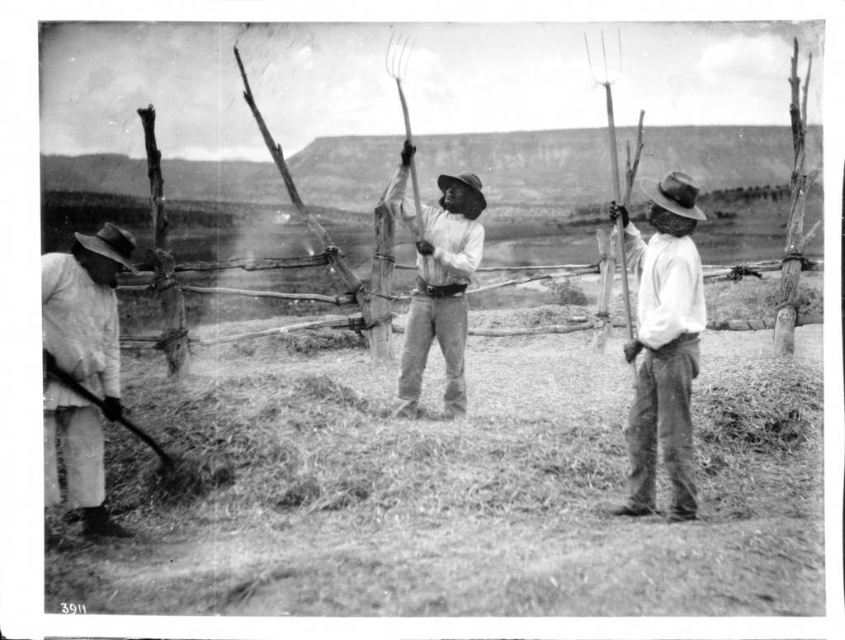
Image resolution: width=845 pixels, height=640 pixels. What do you see at coordinates (663, 344) in the screenshot?
I see `smooth white shirt at right` at bounding box center [663, 344].

Is smooth white shirt at right behind smooth wood pitchfork at center?

That is False.

Who is more forward, (698, 337) or (451, 333)?

Point (451, 333)

The image size is (845, 640). What are the coordinates of `smooth white shirt at right` in the screenshot? It's located at (663, 344).

Image resolution: width=845 pixels, height=640 pixels. Describe the element at coordinates (82, 365) in the screenshot. I see `white cotton shirt at left` at that location.

Is white cotton shirt at left to the right of smooth wood pitchfork at center from the viewer's perspective?

No, white cotton shirt at left is not to the right of smooth wood pitchfork at center.

Which is in front, point (42, 492) or point (451, 348)?

Point (42, 492) is more forward.

The height and width of the screenshot is (640, 845). In order to click on white cotton shirt at left in this screenshot , I will do (x=82, y=365).

Is smooth white shirt at right shorter than white cotton shirt at left?

In fact, smooth white shirt at right may be taller than white cotton shirt at left.

Is smooth white shirt at right below white cotton shirt at left?

No, smooth white shirt at right is not below white cotton shirt at left.

Find the location of a particular element. smooth white shirt at right is located at coordinates (663, 344).